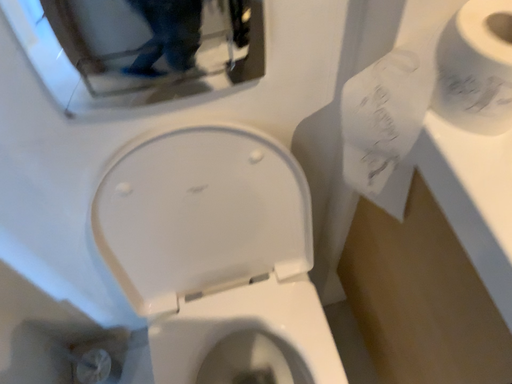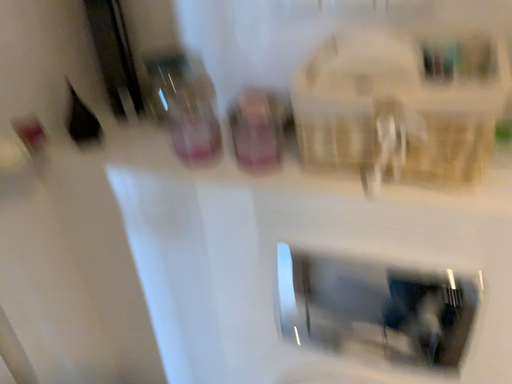
Question: Which way did the camera rotate in the video?

Choices:
 (A) rotated downward
 (B) rotated upward

Answer: (B)